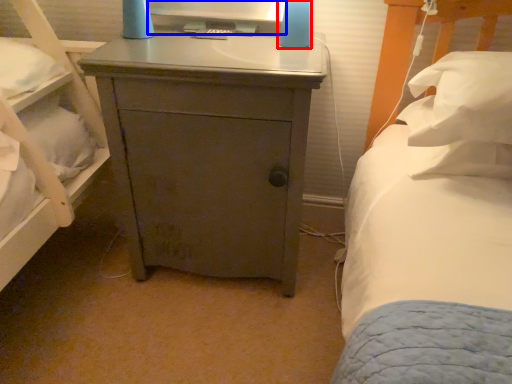
Question: Among these objects, which one is farthest to the camera, bedside lamp (highlighted by a red box) or computer monitor (highlighted by a blue box)?

Choices:
 (A) bedside lamp
 (B) computer monitor

Answer: (B)